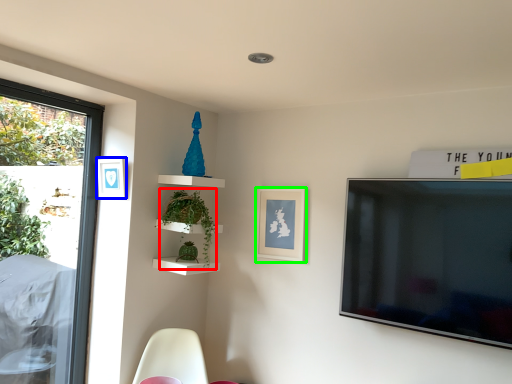
Question: Which object is positioned closest to plant (highlighted by a red box)? Select from picture frame (highlighted by a blue box) and picture frame (highlighted by a green box).

Choices:
 (A) picture frame
 (B) picture frame

Answer: (A)